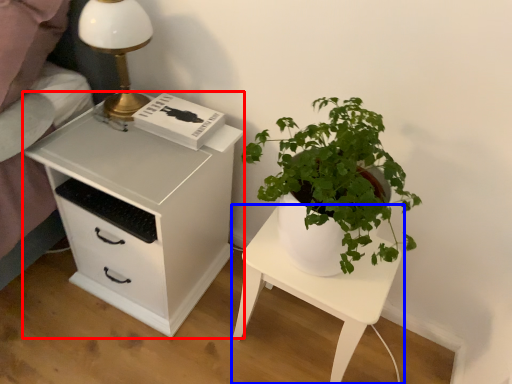
Question: Which object appears farthest to the camera in this image, chest of drawers (highlighted by a red box) or nightstand (highlighted by a blue box)?

Choices:
 (A) chest of drawers
 (B) nightstand

Answer: (B)